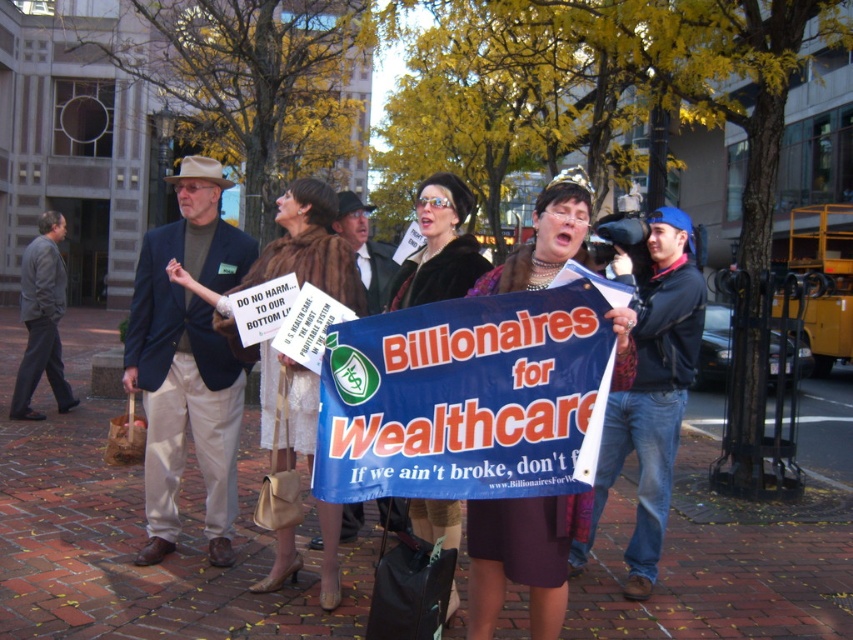
Question: Which point appears farthest from the camera in this image?

Choices:
 (A) (503, 492)
 (B) (653, 628)

Answer: (B)

Question: Among these objects, which one is nearest to the camera?

Choices:
 (A) brown fur coat at center
 (B) velvet brown coat at center
 (C) brick pavement at center

Answer: (A)

Question: Is brick pavement at center below brown fur coat at center?

Choices:
 (A) yes
 (B) no

Answer: (A)

Question: Does blue fabric banner at center appear on the right side of velvet brown coat at center?

Choices:
 (A) yes
 (B) no

Answer: (A)

Question: Is brown fur coat at center thinner than velvet brown coat at center?

Choices:
 (A) no
 (B) yes

Answer: (A)

Question: Among these points, which one is nearest to the camera?

Choices:
 (A) (468, 481)
 (B) (80, 330)
 (C) (270, 419)
 (D) (434, 230)

Answer: (A)